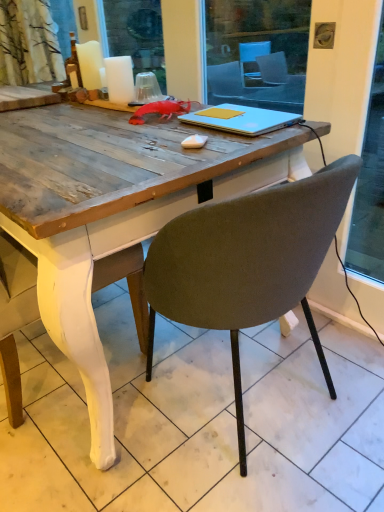
Question: From a real-world perspective, is yellow matte notebook at center, which is the 2th notebook from bottom to top, located higher than silver metallic laptop at center, marked as the 2th notebook in a top-to-bottom arrangement?

Choices:
 (A) no
 (B) yes

Answer: (B)

Question: From the image's perspective, is yellow matte notebook at center, the first notebook when ordered from top to bottom, under silver metallic laptop at center, marked as the 2th notebook in a top-to-bottom arrangement?

Choices:
 (A) no
 (B) yes

Answer: (A)

Question: Is the depth of yellow matte notebook at center, the first notebook when ordered from top to bottom, greater than that of silver metallic laptop at center, the 1th notebook in the bottom-to-top sequence?

Choices:
 (A) no
 (B) yes

Answer: (B)

Question: Is yellow matte notebook at center, the first notebook when ordered from top to bottom, turned away from silver metallic laptop at center, marked as the 2th notebook in a top-to-bottom arrangement?

Choices:
 (A) no
 (B) yes

Answer: (B)

Question: From the image's perspective, is yellow matte notebook at center, the first notebook when ordered from top to bottom, over silver metallic laptop at center, marked as the 2th notebook in a top-to-bottom arrangement?

Choices:
 (A) yes
 (B) no

Answer: (A)

Question: Considering the positions of matte gray chair at center and silver metallic laptop at center, marked as the 2th notebook in a top-to-bottom arrangement, in the image, is matte gray chair at center taller or shorter than silver metallic laptop at center, marked as the 2th notebook in a top-to-bottom arrangement,?

Choices:
 (A) tall
 (B) short

Answer: (A)

Question: From the image's perspective, is matte gray chair at center above or below silver metallic laptop at center, the 1th notebook in the bottom-to-top sequence?

Choices:
 (A) above
 (B) below

Answer: (B)

Question: Considering the positions of point (321, 360) and point (251, 131), is point (321, 360) closer or farther from the camera than point (251, 131)?

Choices:
 (A) closer
 (B) farther

Answer: (B)

Question: Is matte gray chair at center in front of or behind silver metallic laptop at center, the 1th notebook in the bottom-to-top sequence, in the image?

Choices:
 (A) behind
 (B) front

Answer: (B)

Question: Visually, is matte gray chair at center positioned to the left or to the right of white matte candle at upper left, arranged as the 2th candle when viewed from the right?

Choices:
 (A) left
 (B) right

Answer: (B)

Question: Relative to white matte candle at upper left, the second candle from the front, is matte gray chair at center in front or behind?

Choices:
 (A) front
 (B) behind

Answer: (A)

Question: From a real-world perspective, is matte gray chair at center positioned above or below white matte candle at upper left, which appears as the 1th candle when viewed from the left?

Choices:
 (A) above
 (B) below

Answer: (B)

Question: Is matte gray chair at center inside the boundaries of white matte candle at upper left, the second candle from the front, or outside?

Choices:
 (A) outside
 (B) inside

Answer: (A)

Question: Considering the positions of yellow matte notebook at center, the first notebook when ordered from top to bottom, and matte gray chair at center in the image, is yellow matte notebook at center, the first notebook when ordered from top to bottom, taller or shorter than matte gray chair at center?

Choices:
 (A) tall
 (B) short

Answer: (B)

Question: In terms of size, does yellow matte notebook at center, the first notebook when ordered from top to bottom, appear bigger or smaller than matte gray chair at center?

Choices:
 (A) small
 (B) big

Answer: (A)